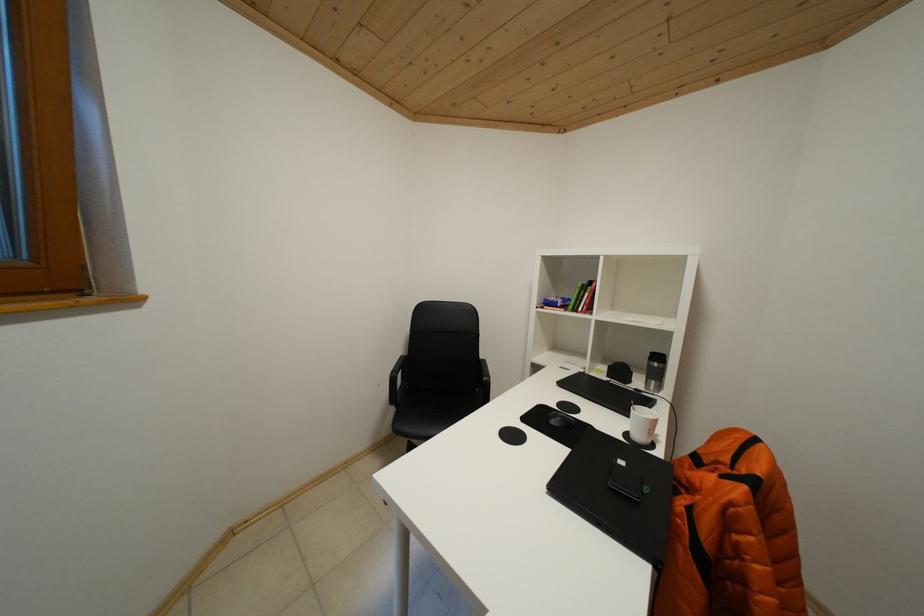
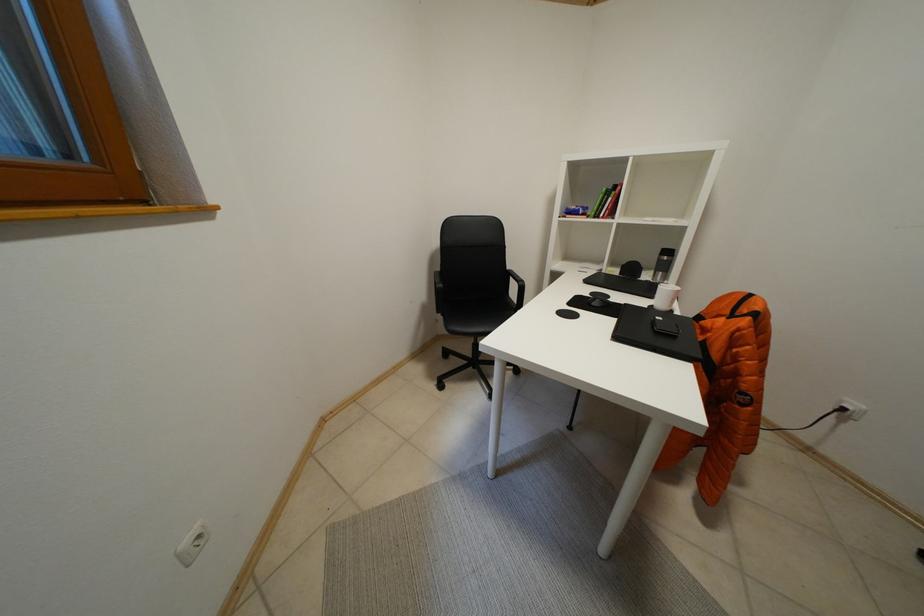
Question: The images are taken continuously from a first-person perspective. In which direction is your viewpoint rotating?

Choices:
 (A) Left
 (B) Right
 (C) Up
 (D) Down

Answer: (D)